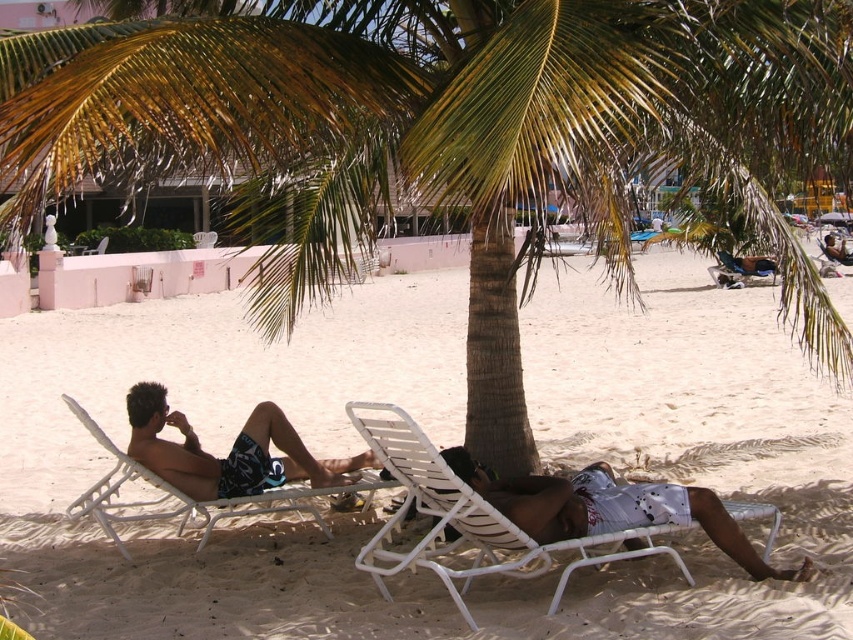
Consider the image. You are standing at the center of the beach and want to walk towards the green leafy palm tree at center. Which direction should you face to walk straight towards it?

Since the green leafy palm tree at center is located at coordinates 0.209 on the x and 0.525 on the y, you should face towards the center of the beach to walk straight towards it.

You are a photographer trying to capture the white textured shorts at lower right and the white plastic chair at left in the same frame. Can you see both objects clearly in the photo without any obstruction?

The white textured shorts at lower right is positioned over white plastic chair at left, so the white plastic chair at left is partially or fully covered by the white textured shorts at lower right, making it difficult to see both clearly in the photo without obstruction.

You are a photographer standing on the beach and want to take a photo of the white plastic chair at left and the blue fabric beach chair at center. To ensure both chairs are fully visible in the photo, which chair should you position closer to the camera?

The white plastic chair at left is in front of the blue fabric beach chair at center, so you should position the white plastic chair at left closer to the camera to ensure both are fully visible.